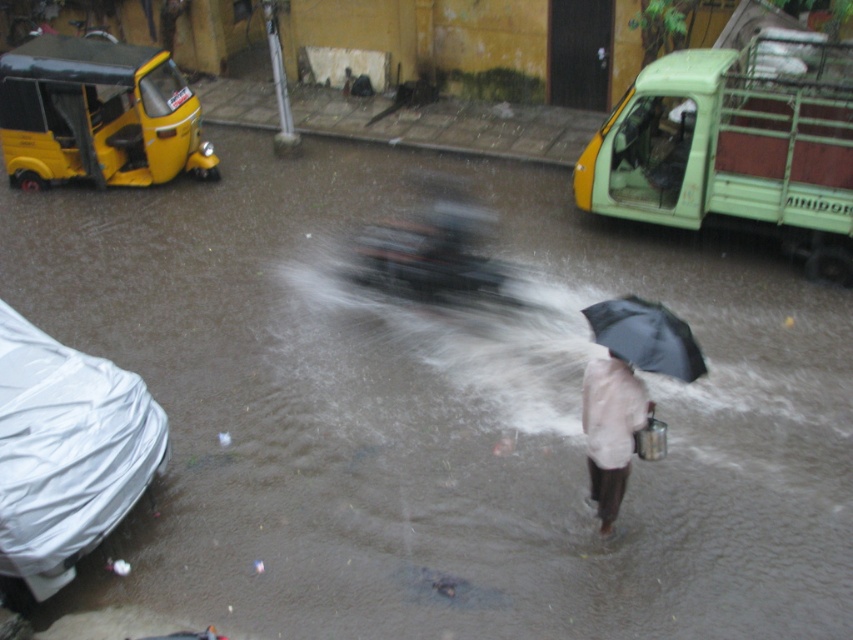
Is point (20, 465) closer to viewer compared to point (94, 140)?

Yes, it is in front of point (94, 140).

Does white plastic car at lower left appear over yellow matte auto-rickshaw at upper left?

No.

Is point (13, 554) more distant than point (173, 172)?

That is False.

Find the location of a particular element. The width and height of the screenshot is (853, 640). white plastic car at lower left is located at coordinates (67, 454).

Between green matte truck at upper right and yellow matte auto-rickshaw at upper left, which one is positioned higher?

yellow matte auto-rickshaw at upper left is above.

Who is positioned more to the right, green matte truck at upper right or yellow matte auto-rickshaw at upper left?

Positioned to the right is green matte truck at upper right.

Is point (755, 52) behind point (49, 125)?

No, it is not.

Find the location of a particular element. The width and height of the screenshot is (853, 640). green matte truck at upper right is located at coordinates (734, 145).

Which is in front, point (767, 120) or point (682, 368)?

Positioned in front is point (682, 368).

The height and width of the screenshot is (640, 853). What do you see at coordinates (734, 145) in the screenshot?
I see `green matte truck at upper right` at bounding box center [734, 145].

Locate an element on the screen. This screenshot has width=853, height=640. green matte truck at upper right is located at coordinates (734, 145).